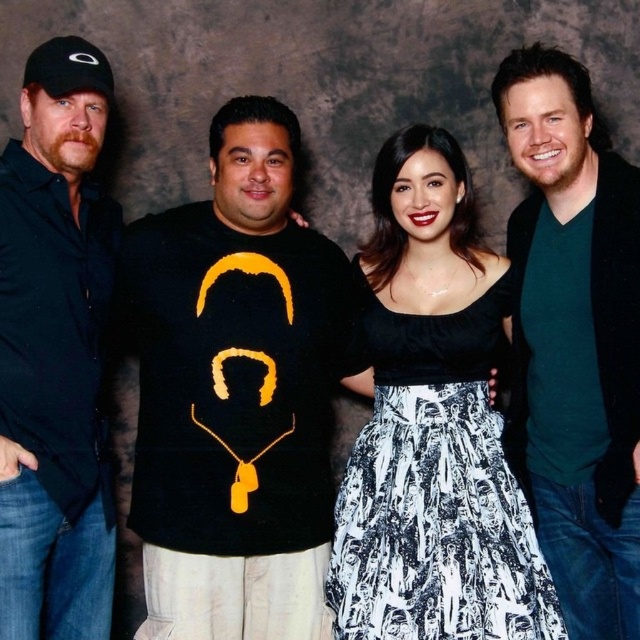
You are standing in front of a group photo and notice two items of clothing. The first is the black satin dress at center, and the second is the black matte shirt at left. Which of these two items is positioned lower in the image?

The black satin dress at center is positioned lower than the black matte shirt at left.